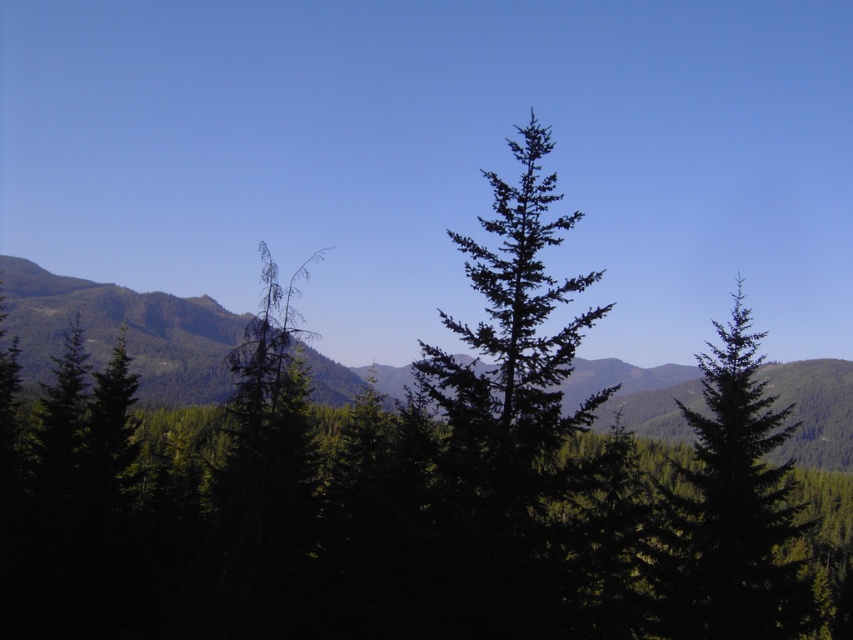
You are an environmental scientist examining the mountainous landscape. You notice the green textured forest at center and the green matte tree at center. Which of these two has a greater area coverage in the scene?

The green textured forest at center has a larger size compared to the green matte tree at center, so it has a greater area coverage in the scene.

Based on the photo, you are a hiker planning to set up a tent in the area shown. You notice the green textured forest at center and the green matte tree at center. Which of these two would block your view more if you set up your tent behind them?

The green textured forest at center is taller than the green matte tree at center, so it would block your view more if you set up your tent behind them.